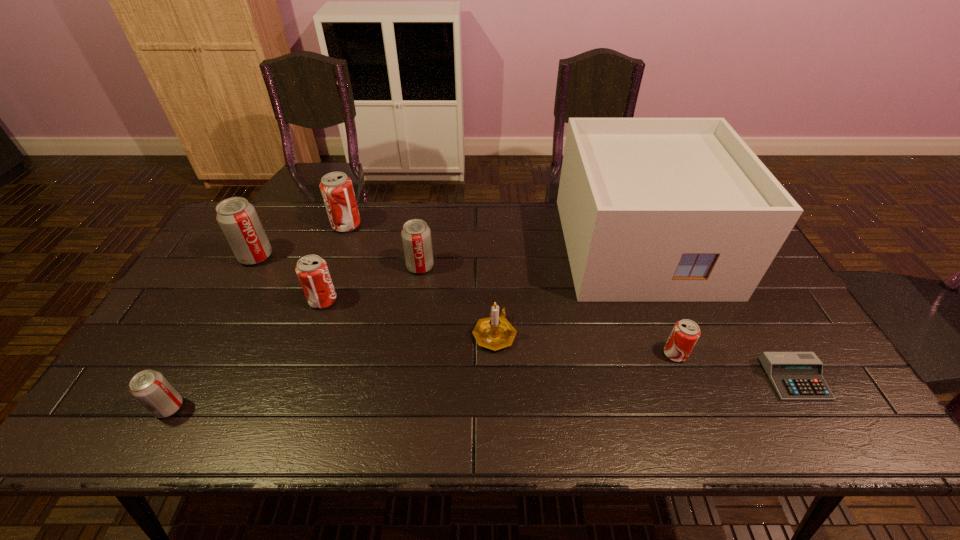
Locate an element on the screen. This screenshot has width=960, height=540. gray box is located at coordinates (652, 209).

Find the location of a particular element. This screenshot has height=540, width=960. box is located at coordinates (652, 209).

The height and width of the screenshot is (540, 960). I want to click on the biggest pink soda can, so click(336, 188).

I want to click on the farthest pink soda can, so click(336, 188).

The image size is (960, 540). What are the coordinates of `the biggest gray soda can` in the screenshot? It's located at 237,218.

You are a GUI agent. You are given a task and a screenshot of the screen. Output one action in this format:
    pyautogui.click(x=<x>, y=<y>)
    Task: Click on the fifth object from right to left
    
    Given the screenshot: What is the action you would take?
    pyautogui.click(x=416, y=236)

Find the location of a particular element. The width and height of the screenshot is (960, 540). the second soda can from right to left is located at coordinates (416, 236).

Where is `the fourth farthest soda can`? the fourth farthest soda can is located at coordinates (312, 271).

The image size is (960, 540). I want to click on the second nearest pink soda can, so click(x=312, y=271).

This screenshot has width=960, height=540. Find the location of `gold candle holder`. gold candle holder is located at coordinates (495, 332).